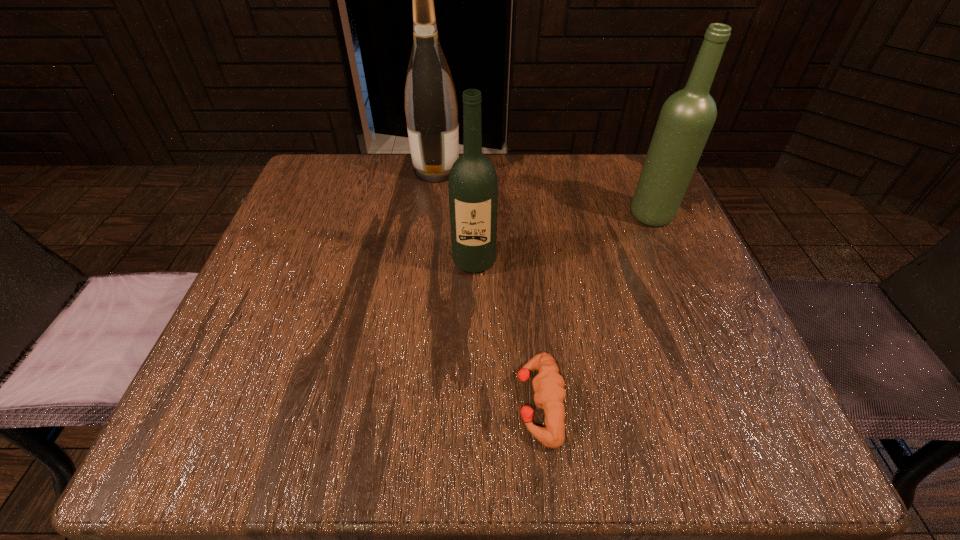
In order to click on the farthest wine bottle in this screenshot , I will do `click(431, 108)`.

Identify the location of the rightmost wine bottle. The image size is (960, 540). (687, 117).

Where is `the second nearest wine bottle`? The width and height of the screenshot is (960, 540). the second nearest wine bottle is located at coordinates (687, 117).

This screenshot has height=540, width=960. What are the coordinates of `the second nearest object` in the screenshot? It's located at (473, 185).

This screenshot has height=540, width=960. Identify the location of the third object from left to right. (548, 384).

Identify the location of puncher. (548, 384).

Where is `free location located 0.340m on the label of the farthest wine bottle`? This screenshot has width=960, height=540. free location located 0.340m on the label of the farthest wine bottle is located at coordinates click(600, 170).

Locate an element on the screen. Image resolution: width=960 pixels, height=540 pixels. free space located on the back of the rightmost wine bottle is located at coordinates (637, 181).

You are a GUI agent. You are given a task and a screenshot of the screen. Output one action in this format:
    pyautogui.click(x=<x>, y=<y>)
    Task: Click on the free location located 0.230m on the labeled side of the third farthest object
    
    Given the screenshot: What is the action you would take?
    pyautogui.click(x=472, y=387)

This screenshot has height=540, width=960. Identify the location of blank space located with the gloves of the puncher facing forward. (448, 403).